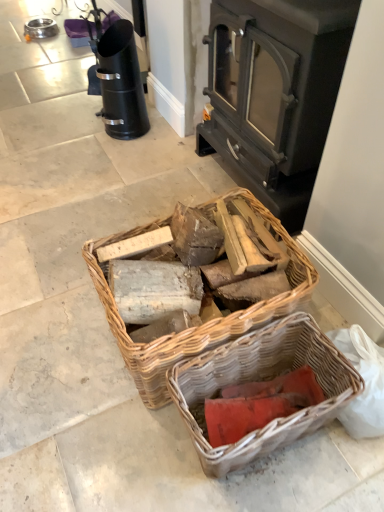
Question: Is dark gray metal wood burning stove at center bigger than woven wood basket at center, which ranks as the 2th picnic basket in bottom-to-top order?

Choices:
 (A) no
 (B) yes

Answer: (B)

Question: Is dark gray metal wood burning stove at center positioned before woven wood basket at center, the first picnic basket viewed from the top?

Choices:
 (A) yes
 (B) no

Answer: (B)

Question: Is dark gray metal wood burning stove at center next to woven wood basket at center, which ranks as the 2th picnic basket in bottom-to-top order, and touching it?

Choices:
 (A) no
 (B) yes

Answer: (A)

Question: Is dark gray metal wood burning stove at center to the right of woven wood basket at center, the first picnic basket viewed from the top, from the viewer's perspective?

Choices:
 (A) yes
 (B) no

Answer: (A)

Question: Is dark gray metal wood burning stove at center thinner than woven wood basket at center, the first picnic basket viewed from the top?

Choices:
 (A) no
 (B) yes

Answer: (B)

Question: Can you confirm if dark gray metal wood burning stove at center is positioned to the left of woven wood basket at center, the first picnic basket viewed from the top?

Choices:
 (A) no
 (B) yes

Answer: (A)

Question: Can you confirm if dark gray metal wood burning stove at center is bigger than rustic wicker basket at lower center, which is the 1th picnic basket in bottom-to-top order?

Choices:
 (A) yes
 (B) no

Answer: (A)

Question: Is dark gray metal wood burning stove at center completely or partially outside of rustic wicker basket at lower center, which appears as the second picnic basket when viewed from the top?

Choices:
 (A) yes
 (B) no

Answer: (A)

Question: From the image's perspective, does dark gray metal wood burning stove at center appear higher than rustic wicker basket at lower center, which appears as the second picnic basket when viewed from the top?

Choices:
 (A) yes
 (B) no

Answer: (A)

Question: Is rustic wicker basket at lower center, which appears as the second picnic basket when viewed from the top, a part of dark gray metal wood burning stove at center?

Choices:
 (A) yes
 (B) no

Answer: (B)

Question: From a real-world perspective, is dark gray metal wood burning stove at center positioned under rustic wicker basket at lower center, which is the 1th picnic basket in bottom-to-top order, based on gravity?

Choices:
 (A) yes
 (B) no

Answer: (B)

Question: Would you say dark gray metal wood burning stove at center is a long distance from rustic wicker basket at lower center, which is the 1th picnic basket in bottom-to-top order?

Choices:
 (A) no
 (B) yes

Answer: (A)

Question: From the image's perspective, is rustic wicker basket at lower center, which is the 1th picnic basket in bottom-to-top order, on top of woven wood basket at center, the first picnic basket viewed from the top?

Choices:
 (A) no
 (B) yes

Answer: (A)